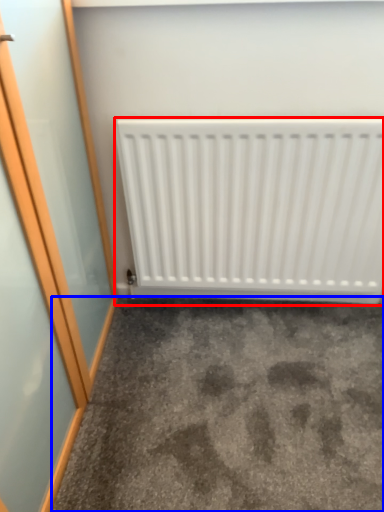
Question: Which of the following is the farthest to the observer, radiator (highlighted by a red box) or concrete (highlighted by a blue box)?

Choices:
 (A) radiator
 (B) concrete

Answer: (A)